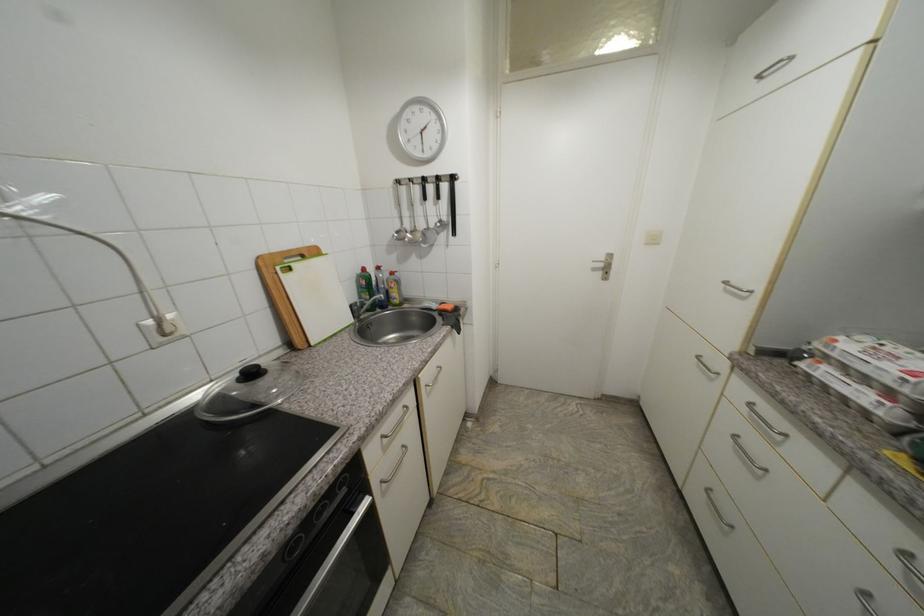
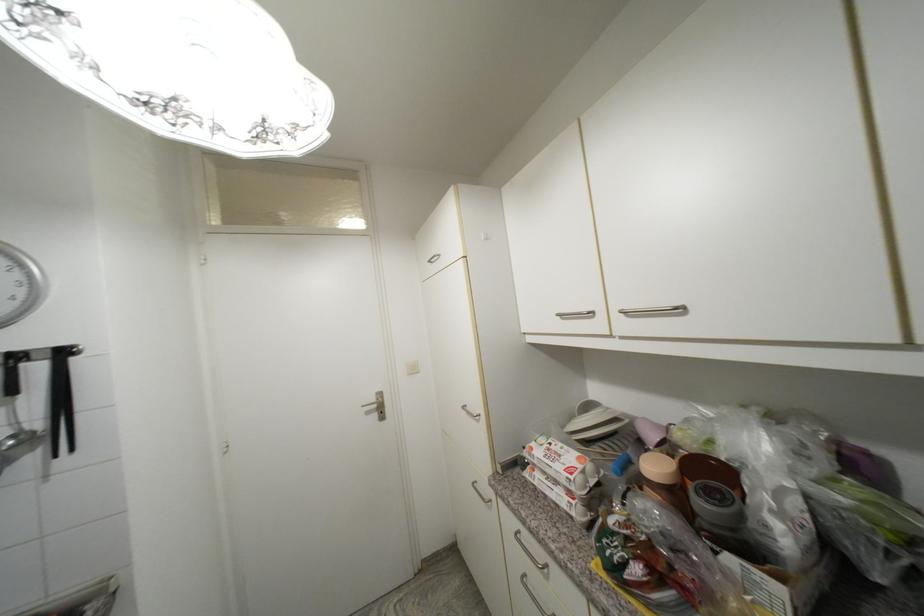
Locate, in the second image, the point that corresponds to [821,376] in the first image.

(541, 485)